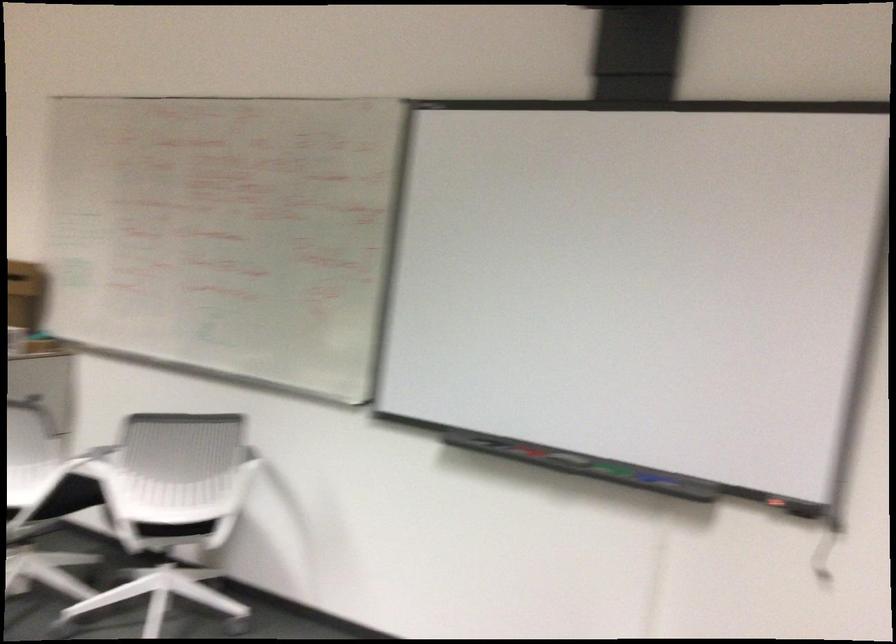
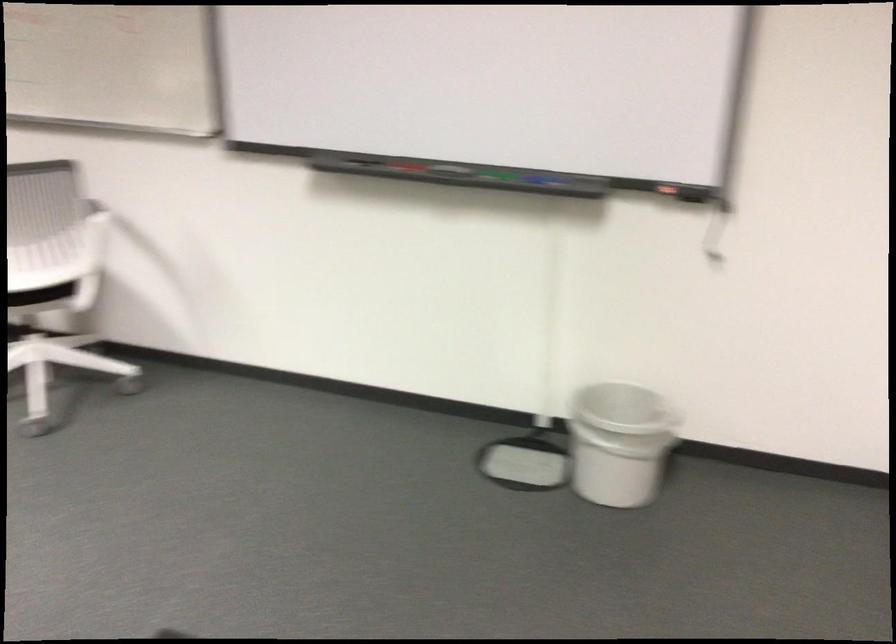
Locate, in the second image, the point that corresponds to [652,478] in the first image.

(536, 178)